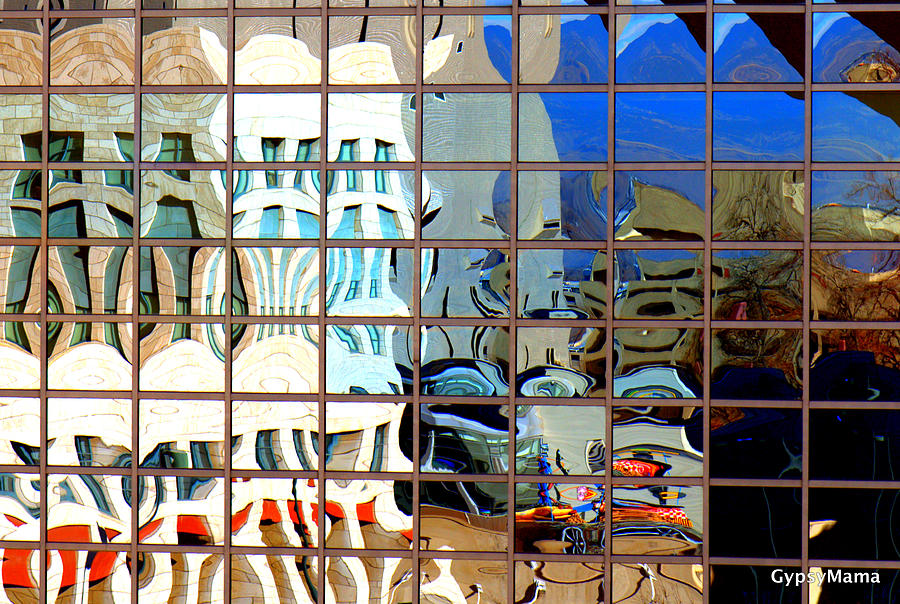
Find the location of `brick wall`. brick wall is located at coordinates (245, 583), (202, 579), (176, 585).